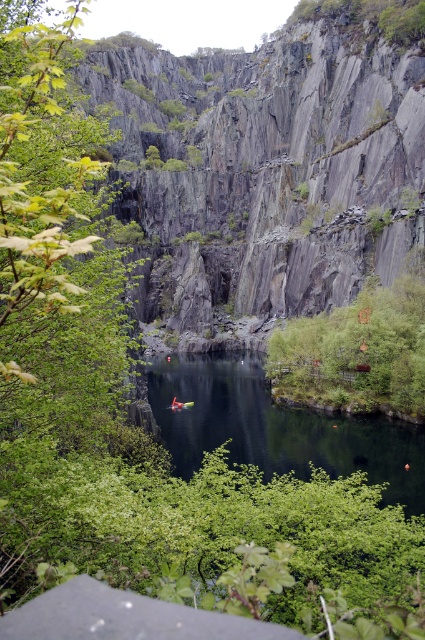
Question: Is greenish reflective water at center above green leafy tree at center-right?

Choices:
 (A) no
 (B) yes

Answer: (A)

Question: Can you confirm if greenish reflective water at center is thinner than green leafy tree at center-right?

Choices:
 (A) yes
 (B) no

Answer: (B)

Question: Is greenish reflective water at center wider than green leafy tree at center-right?

Choices:
 (A) yes
 (B) no

Answer: (A)

Question: Which point is farther from the camera taking this photo?

Choices:
 (A) (198, 426)
 (B) (334, 333)

Answer: (A)

Question: Which point appears closest to the camera in this image?

Choices:
 (A) (362, 428)
 (B) (374, 310)

Answer: (A)